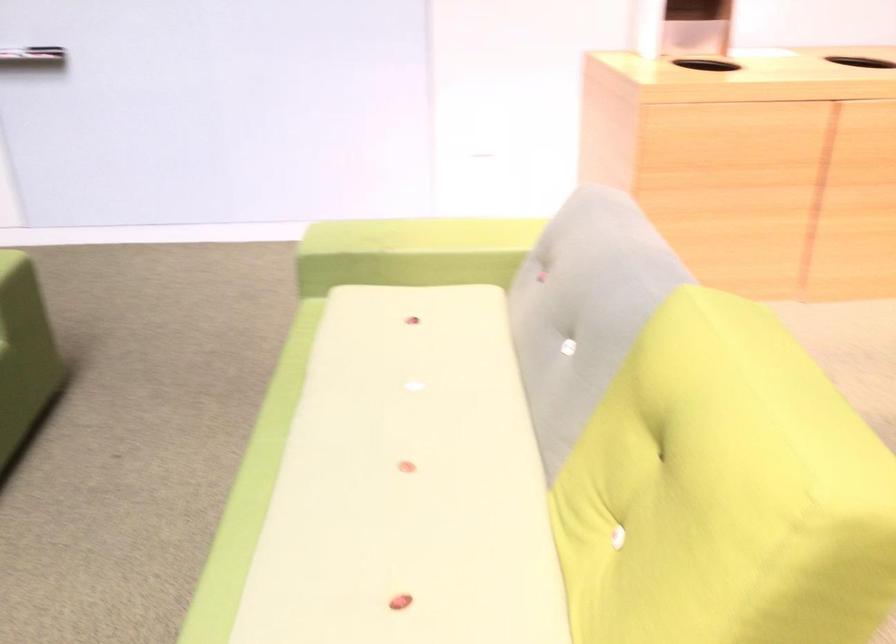
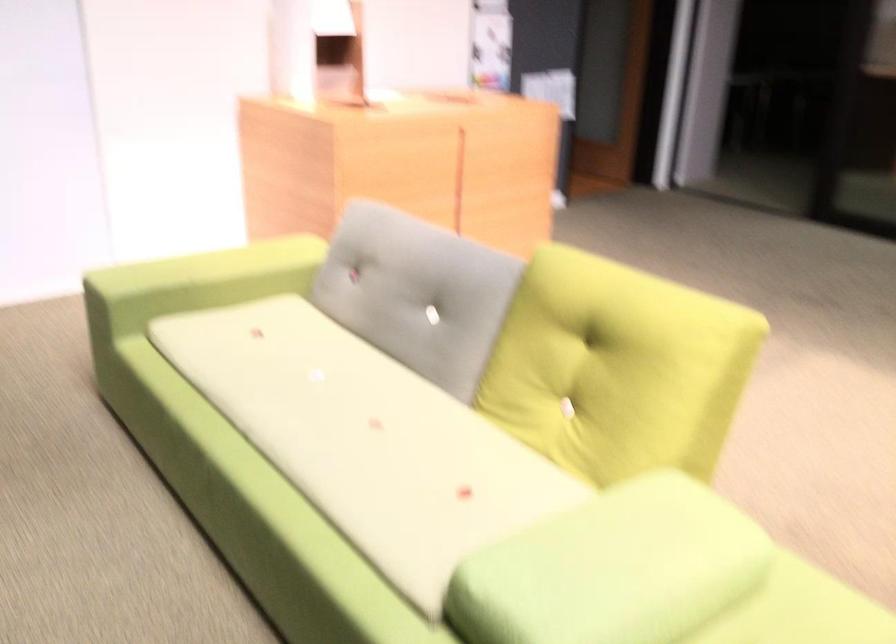
Find the pixel in the second image that matches point 670,500 in the first image.

(616, 368)